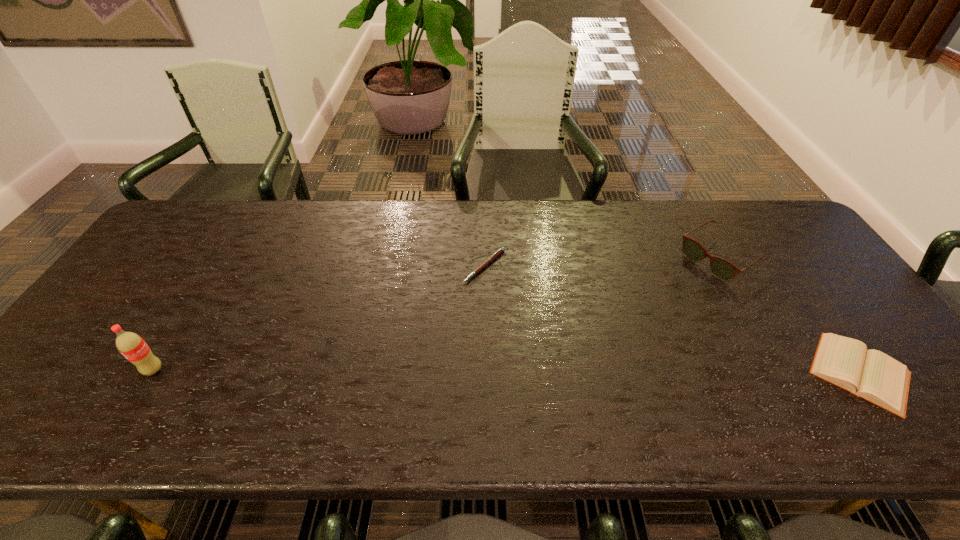
Identify the location of vacant spot on the desktop that is between the soda and the diary and is positioned at the nib of the second object from left to right. The height and width of the screenshot is (540, 960). (536, 372).

At what (x,y) coordinates should I click in order to perform the action: click on vacant spot on the desktop that is between the leftmost object and the diary and is positioned at the front view of the spectacles. Please return your answer as a coordinate pair (x, y). The image size is (960, 540). Looking at the image, I should click on (543, 372).